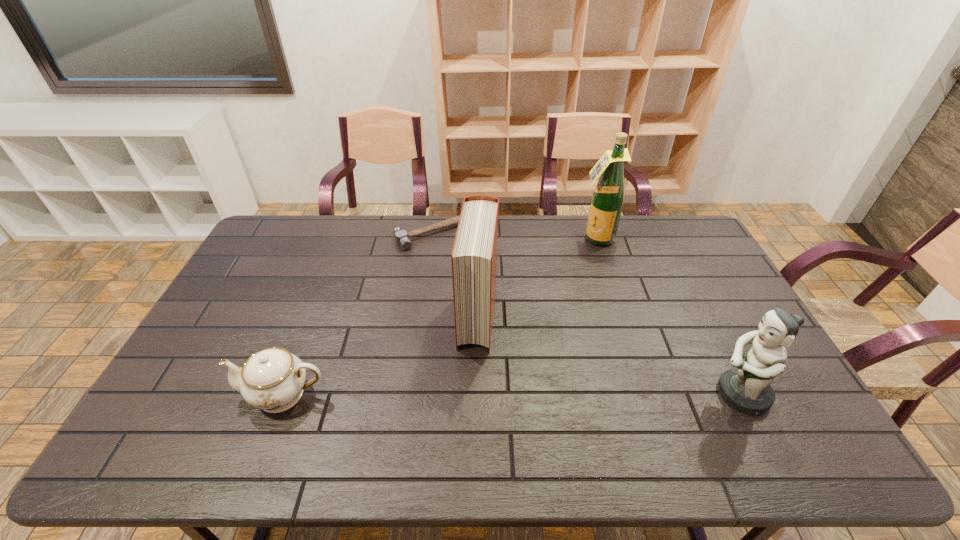
Find the location of a particular element. Image resolution: width=960 pixels, height=540 pixels. free space located 0.070m on the open cover of the third nearest object is located at coordinates (472, 373).

Locate an element on the screen. This screenshot has height=540, width=960. vacant region located 0.080m on the open cover of the third nearest object is located at coordinates coord(472,376).

Locate an element on the screen. The image size is (960, 540). vacant position located 0.080m on the open cover of the third nearest object is located at coordinates (472, 376).

The image size is (960, 540). Identify the location of hammer at the far edge. (401, 236).

The width and height of the screenshot is (960, 540). In order to click on liquor positioned at the far edge in this screenshot , I will do `click(607, 201)`.

Identify the location of chinaware at the near edge. (273, 379).

This screenshot has width=960, height=540. I want to click on figurine located at the near edge, so click(x=747, y=388).

The image size is (960, 540). Find the location of `object that is at the right edge`. object that is at the right edge is located at coordinates (747, 388).

The width and height of the screenshot is (960, 540). I want to click on object that is at the near right corner, so click(747, 388).

What are the coordinates of `vacant space at the far edge` in the screenshot? It's located at (579, 241).